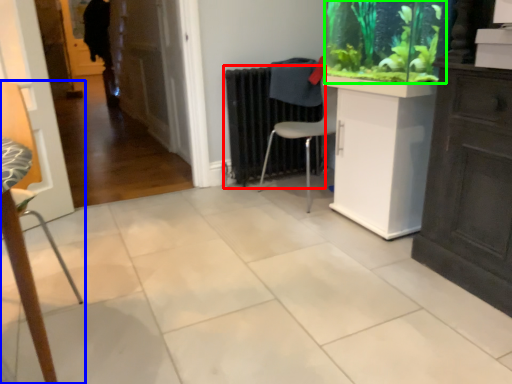
Question: Estimate the real-world distances between objects in this image. Which object is farther from radiator (highlighted by a red box), chair (highlighted by a blue box) or plant (highlighted by a green box)?

Choices:
 (A) chair
 (B) plant

Answer: (A)